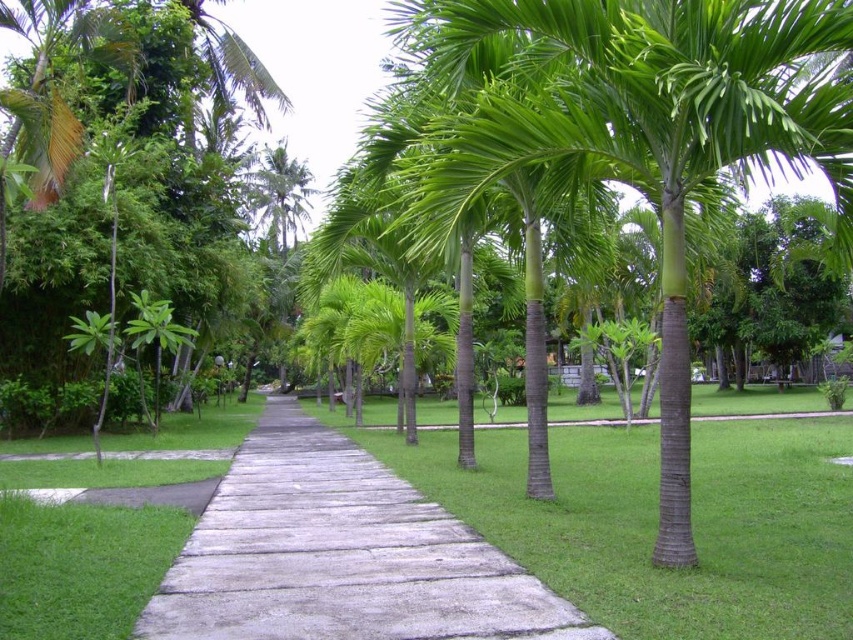
Question: Does green grass at center appear under gray concrete pavement at center?

Choices:
 (A) yes
 (B) no

Answer: (A)

Question: Which point is closer to the camera taking this photo?

Choices:
 (A) (566, 611)
 (B) (706, 529)

Answer: (A)

Question: Among these objects, which one is nearest to the camera?

Choices:
 (A) gray concrete pavement at center
 (B) green grass at center

Answer: (B)

Question: Is green grass at center further to the viewer compared to gray concrete pavement at center?

Choices:
 (A) yes
 (B) no

Answer: (B)

Question: Where is green grass at center located in relation to gray concrete pavement at center in the image?

Choices:
 (A) left
 (B) right

Answer: (B)